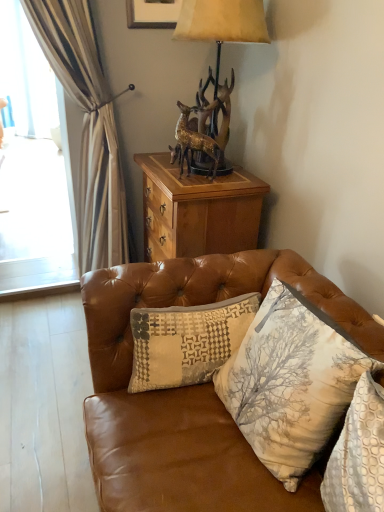
What do you see at coordinates (152, 14) in the screenshot? Image resolution: width=384 pixels, height=512 pixels. I see `matte gray picture frame at upper center` at bounding box center [152, 14].

The height and width of the screenshot is (512, 384). What do you see at coordinates (359, 452) in the screenshot?
I see `printed fabric cushion at lower right, arranged as the 3th pillow when viewed from the left` at bounding box center [359, 452].

Image resolution: width=384 pixels, height=512 pixels. What do you see at coordinates (187, 341) in the screenshot? I see `textured beige pillow at center, which is the 3th pillow from right to left` at bounding box center [187, 341].

Where is `beige textured pillow at center, the second pillow in the right-to-left sequence`? beige textured pillow at center, the second pillow in the right-to-left sequence is located at coordinates (290, 382).

Would you say textured beige pillow at center, which ranks as the 1th pillow in left-to-right order, is inside or outside matte gray picture frame at upper center?

textured beige pillow at center, which ranks as the 1th pillow in left-to-right order, is outside matte gray picture frame at upper center.

Is matte gray picture frame at upper center at the back of textured beige pillow at center, which ranks as the 1th pillow in left-to-right order?

textured beige pillow at center, which ranks as the 1th pillow in left-to-right order, does not have its back to matte gray picture frame at upper center.

Is textured beige pillow at center, which ranks as the 1th pillow in left-to-right order, closer to the viewer compared to matte gray picture frame at upper center?

Yes.

Where is `picture frame behind the textured beige pillow at center, which is the 3th pillow from right to left`? The height and width of the screenshot is (512, 384). picture frame behind the textured beige pillow at center, which is the 3th pillow from right to left is located at coordinates (152, 14).

Image resolution: width=384 pixels, height=512 pixels. In order to click on the 2nd pillow in front of the gold metallic lamp at upper center, counting from the anchor's position in this screenshot , I will do `click(290, 382)`.

Measure the distance between beige textured pillow at center, the second pillow in the right-to-left sequence, and gold metallic lamp at upper center.

1.22 meters.

From the image's perspective, which is above, beige textured pillow at center, placed as the 2th pillow when sorted from left to right, or gold metallic lamp at upper center?

gold metallic lamp at upper center.

Identify the location of the 1st pillow positioned below the printed fabric cushion at lower right, arranged as the 3th pillow when viewed from the left (from a real-world perspective). The width and height of the screenshot is (384, 512). (290, 382).

How different are the orientations of beige textured pillow at center, the second pillow in the right-to-left sequence, and printed fabric cushion at lower right, arranged as the 3th pillow when viewed from the left, in degrees?

beige textured pillow at center, the second pillow in the right-to-left sequence, and printed fabric cushion at lower right, arranged as the 3th pillow when viewed from the left, are facing 3.98 degrees away from each other.

Would you say beige textured pillow at center, the second pillow in the right-to-left sequence, is outside printed fabric cushion at lower right, arranged as the 3th pillow when viewed from the left?

Yes.

Which of these two, beige textured pillow at center, the second pillow in the right-to-left sequence, or printed fabric cushion at lower right, positioned as the 1th pillow in right-to-left order, is smaller?

printed fabric cushion at lower right, positioned as the 1th pillow in right-to-left order.

Is gold metallic deer at center aimed at matte gray picture frame at upper center?

No.

In the scene shown: Considering the sizes of objects gold metallic deer at center and matte gray picture frame at upper center in the image provided, who is bigger, gold metallic deer at center or matte gray picture frame at upper center?

→ matte gray picture frame at upper center is bigger.

Between gold metallic deer at center and matte gray picture frame at upper center, which one has more height?

matte gray picture frame at upper center.

Is point (181, 163) farther from camera compared to point (176, 14)?

That is False.

Is point (168, 6) more distant than point (209, 114)?

Yes.

Does matte gray picture frame at upper center have a lesser height compared to gold metallic deer at center?

No, matte gray picture frame at upper center is not shorter than gold metallic deer at center.

Can you confirm if matte gray picture frame at upper center is wider than gold metallic deer at center?

No, matte gray picture frame at upper center is not wider than gold metallic deer at center.

Is matte gray picture frame at upper center not inside gold metallic deer at center?

matte gray picture frame at upper center is positioned outside gold metallic deer at center.

Considering the points (375, 430) and (173, 24), which point is behind, point (375, 430) or point (173, 24)?

The point (173, 24) is farther from the camera.

Is printed fabric cushion at lower right, positioned as the 1th pillow in right-to-left order, aimed at matte gray picture frame at upper center?

No.

From a real-world perspective, which object stands above the other?

From a 3D spatial view, gold metallic lamp at upper center is above.

From the image's perspective, which is above, gold metallic lamp at upper center or printed fabric cushion at lower right, arranged as the 3th pillow when viewed from the left?

gold metallic lamp at upper center appears higher in the image.

Is gold metallic lamp at upper center in front of printed fabric cushion at lower right, arranged as the 3th pillow when viewed from the left?

No.

Which pillow is the 1st one when counting from the front of the matte gray picture frame at upper center? Please provide its 2D coordinates.

[(187, 341)]

From a real-world perspective, starting from the gold metallic lamp at upper center, which pillow is the 2nd one below it? Please provide its 2D coordinates.

[(290, 382)]

Estimate the real-world distances between objects in this image. Which object is further from leather couch at center, gold metallic deer at center or beige textured pillow at center, the second pillow in the right-to-left sequence?

The object further to leather couch at center is gold metallic deer at center.

Looking at the image, which one is located further to gold metallic deer at center, wooden cabinet at upper center or leather couch at center?

leather couch at center is further to gold metallic deer at center.

Looking at the image, which one is located closer to matte gray picture frame at upper center, wooden cabinet at upper center or gold metallic lamp at upper center?

gold metallic lamp at upper center is closer to matte gray picture frame at upper center.

Considering their positions, is wooden cabinet at upper center positioned further to printed fabric cushion at lower right, arranged as the 3th pillow when viewed from the left, than matte gray picture frame at upper center?

matte gray picture frame at upper center lies further to printed fabric cushion at lower right, arranged as the 3th pillow when viewed from the left, than the other object.

Looking at the image, which one is located further to beige textured pillow at center, the second pillow in the right-to-left sequence, matte gray picture frame at upper center or wooden cabinet at upper center?

matte gray picture frame at upper center is positioned further to the anchor beige textured pillow at center, the second pillow in the right-to-left sequence.

Estimate the real-world distances between objects in this image. Which object is further from printed fabric cushion at lower right, positioned as the 1th pillow in right-to-left order, leather couch at center or gold metallic lamp at upper center?

Among the two, gold metallic lamp at upper center is located further to printed fabric cushion at lower right, positioned as the 1th pillow in right-to-left order.

When comparing their distances from gold metallic deer at center, does printed fabric cushion at lower right, positioned as the 1th pillow in right-to-left order, or beige textured pillow at center, the second pillow in the right-to-left sequence, seem further?

printed fabric cushion at lower right, positioned as the 1th pillow in right-to-left order, is further to gold metallic deer at center.

Estimate the real-world distances between objects in this image. Which object is further from leather couch at center, matte gray picture frame at upper center or textured beige pillow at center, which ranks as the 1th pillow in left-to-right order?

matte gray picture frame at upper center is positioned further to the anchor leather couch at center.

The width and height of the screenshot is (384, 512). Identify the location of animal between matte gray picture frame at upper center and wooden cabinet at upper center from top to bottom. (203, 128).

The width and height of the screenshot is (384, 512). I want to click on pillow between gold metallic deer at center and beige textured pillow at center, the second pillow in the right-to-left sequence, in the vertical direction, so click(x=187, y=341).

The image size is (384, 512). Find the location of `pillow between beige textured pillow at center, the second pillow in the right-to-left sequence, and wooden cabinet at upper center in the front-back direction`. pillow between beige textured pillow at center, the second pillow in the right-to-left sequence, and wooden cabinet at upper center in the front-back direction is located at coordinates (187, 341).

Image resolution: width=384 pixels, height=512 pixels. In order to click on lamp that lies between matte gray picture frame at upper center and wooden cabinet at upper center from top to bottom in this screenshot , I will do `click(222, 24)`.